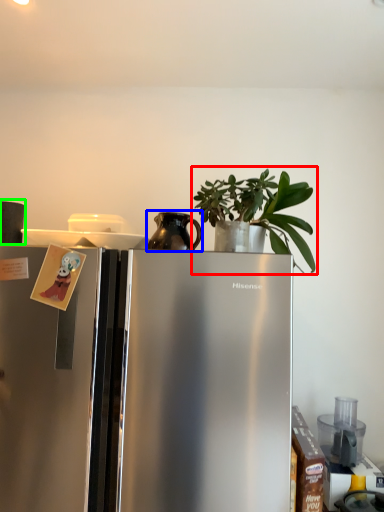
Question: Which object is the farthest from houseplant (highlighted by a red box)? Choose among these: appliance (highlighted by a blue box) or appliance (highlighted by a green box).

Choices:
 (A) appliance
 (B) appliance

Answer: (B)